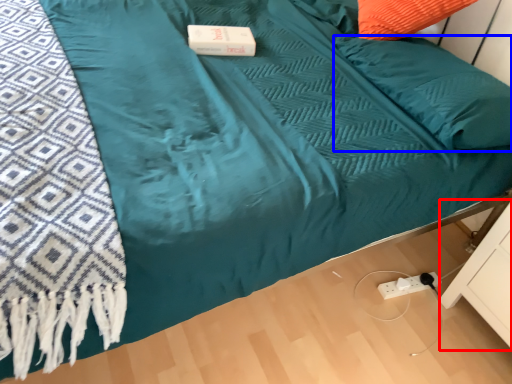
Question: Which point is further to the camera, drawer (highlighted by a red box) or pillow (highlighted by a blue box)?

Choices:
 (A) drawer
 (B) pillow

Answer: (B)